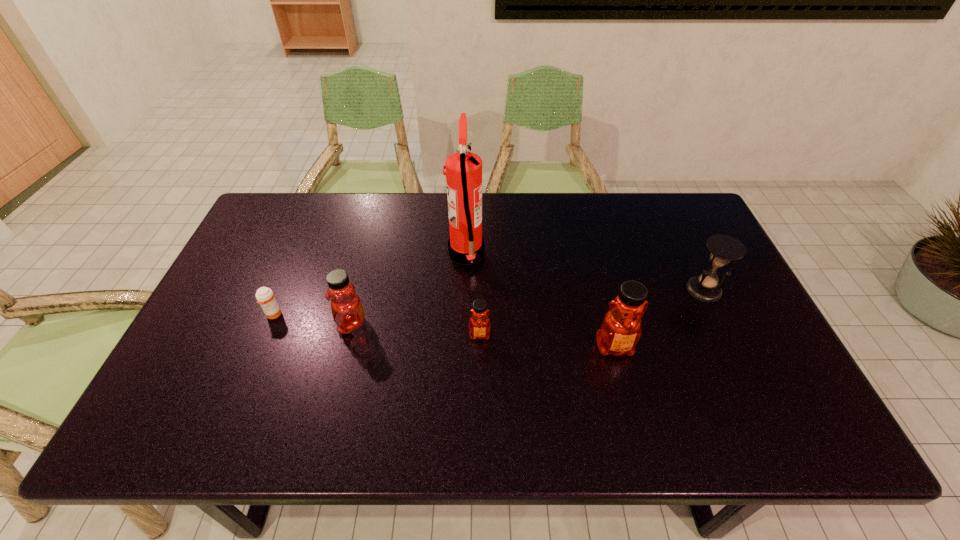
Locate an element on the screen. free space between the shortest honey and the rightmost honey is located at coordinates (547, 341).

At what (x,y) coordinates should I click in order to perform the action: click on vacant area that lies between the second tallest honey and the rightmost object. Please return your answer as a coordinate pair (x, y). This screenshot has width=960, height=540. Looking at the image, I should click on (527, 307).

What are the coordinates of `free space between the rightmost object and the fire extinguisher` in the screenshot? It's located at (585, 272).

This screenshot has width=960, height=540. In order to click on the second closest object to the fifth object from left to right in this screenshot , I will do `click(479, 324)`.

Point out which object is positioned as the nearest to the fire extinguisher. Please provide its 2D coordinates. Your answer should be formatted as a tuple, i.e. [(x, y)], where the tuple contains the x and y coordinates of a point satisfying the conditions above.

[(479, 324)]

Select which honey is the second closest to the rightmost object. Please provide its 2D coordinates. Your answer should be formatted as a tuple, i.e. [(x, y)], where the tuple contains the x and y coordinates of a point satisfying the conditions above.

[(479, 324)]

Identify which honey is the second nearest to the rightmost honey. Please provide its 2D coordinates. Your answer should be formatted as a tuple, i.e. [(x, y)], where the tuple contains the x and y coordinates of a point satisfying the conditions above.

[(346, 306)]

Locate an element on the screen. The height and width of the screenshot is (540, 960). vacant space that satisfies the following two spatial constraints: 1. with the nozzle aimed from the fire extinguisher; 2. on the back side of the hourglass is located at coordinates (466, 289).

Locate an element on the screen. blank space that satisfies the following two spatial constraints: 1. with the nozzle aimed from the tallest object; 2. on the front side of the leftmost object is located at coordinates (465, 314).